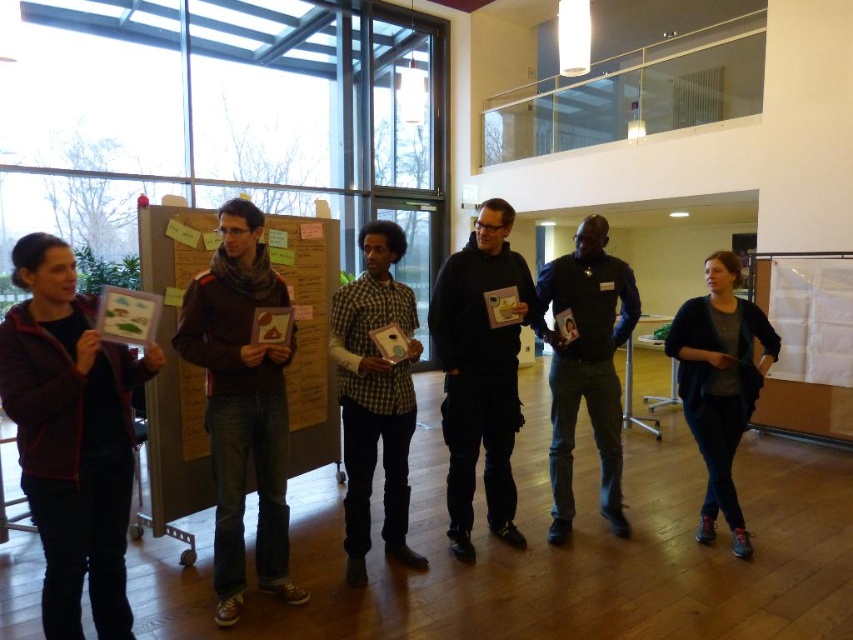
You are organizing a gallery walk in the office and need to place two items on the wall. You have a wooden noticeboard at left and a matte cardboard poster at left. According to the scene, which item is located to the right of the other?

The wooden noticeboard at left is positioned on the right side of the matte cardboard poster at left, so the wooden noticeboard at left is to the right of the matte cardboard poster at left.